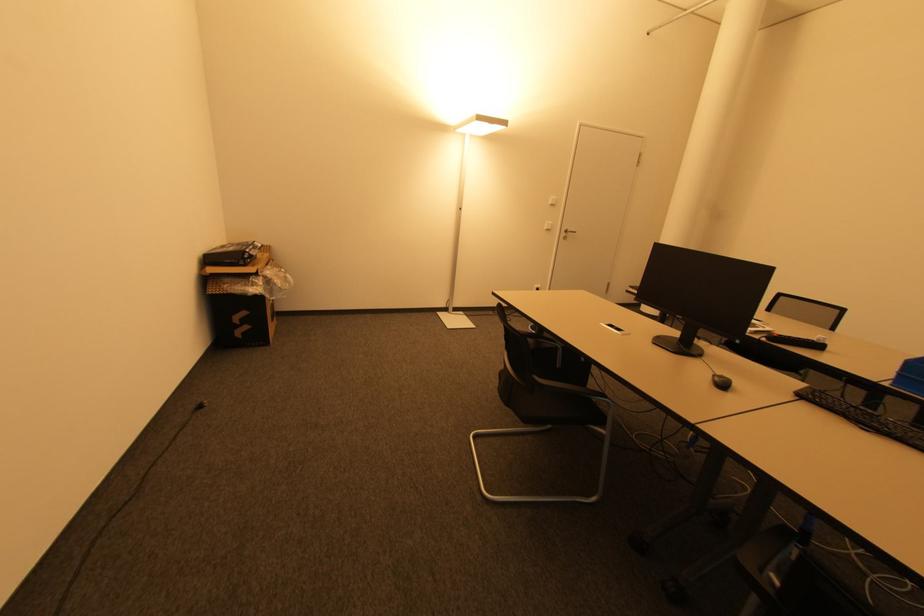
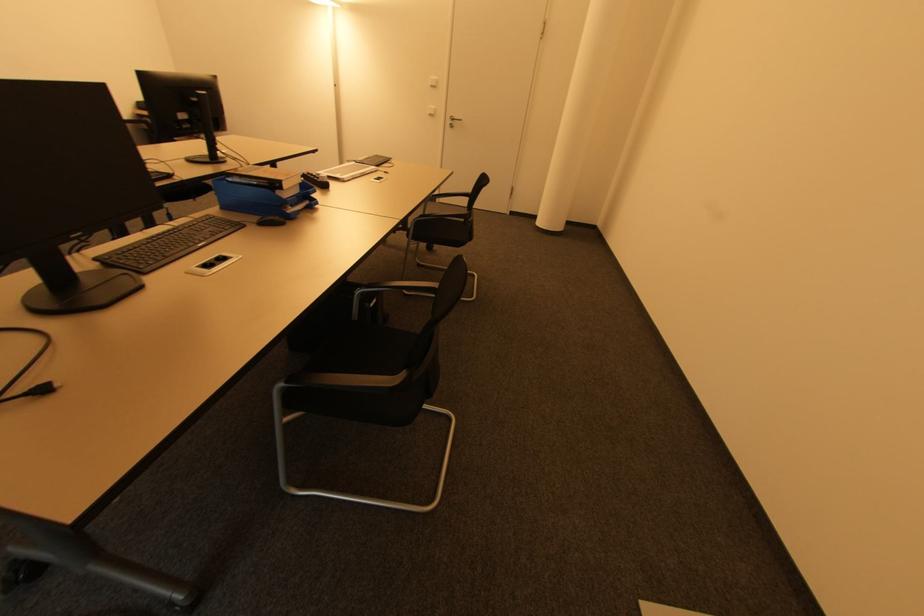
Locate, in the second image, the point that corresponds to point 553,206 in the first image.

(434, 87)